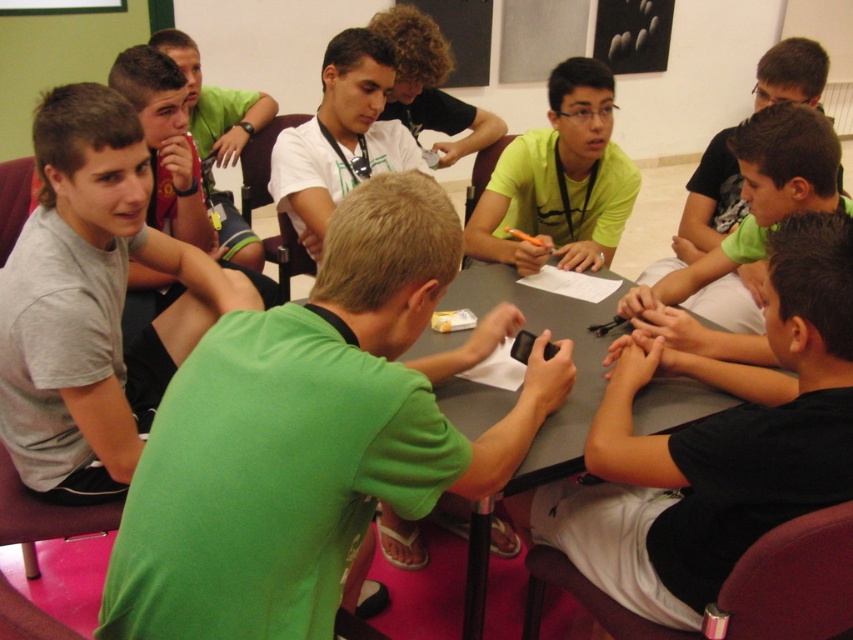
Is black matte phone at center further to camera compared to black matte shirt at upper right?

No.

Is point (773, 516) positioned before point (724, 172)?

Yes, it is.

This screenshot has width=853, height=640. What do you see at coordinates (717, 444) in the screenshot?
I see `black matte phone at center` at bounding box center [717, 444].

Locate an element on the screen. The width and height of the screenshot is (853, 640). black matte phone at center is located at coordinates (717, 444).

Between yellow matte shirt at center and black matte shirt at upper right, which one appears on the left side from the viewer's perspective?

yellow matte shirt at center is more to the left.

Is point (610, 180) in front of point (728, 221)?

Yes, point (610, 180) is closer to viewer.

Is point (590, 257) more distant than point (717, 136)?

That is False.

Locate an element on the screen. Image resolution: width=853 pixels, height=640 pixels. yellow matte shirt at center is located at coordinates (560, 180).

Does black matte phone at center have a greater width compared to smooth gray table at center?

Incorrect, black matte phone at center's width does not surpass smooth gray table at center's.

Who is more forward, (659, 602) or (579, 449)?

Point (659, 602) is more forward.

Is point (598, 470) closer to viewer compared to point (466, 337)?

Yes.

Identify the location of black matte phone at center. The height and width of the screenshot is (640, 853). (717, 444).